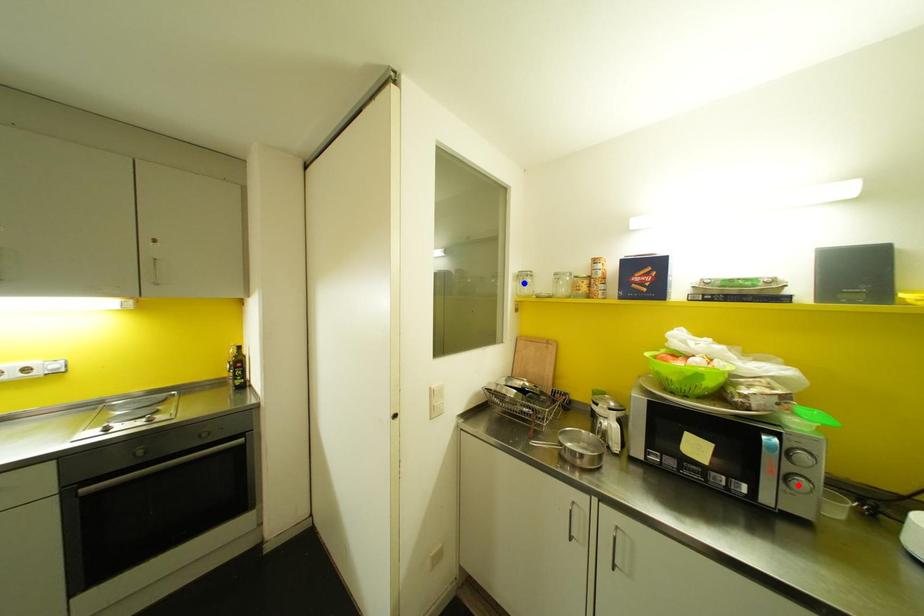
Question: Which of the two points in the image is closer to the camera?

Choices:
 (A) Blue point is closer.
 (B) Red point is closer.

Answer: (B)